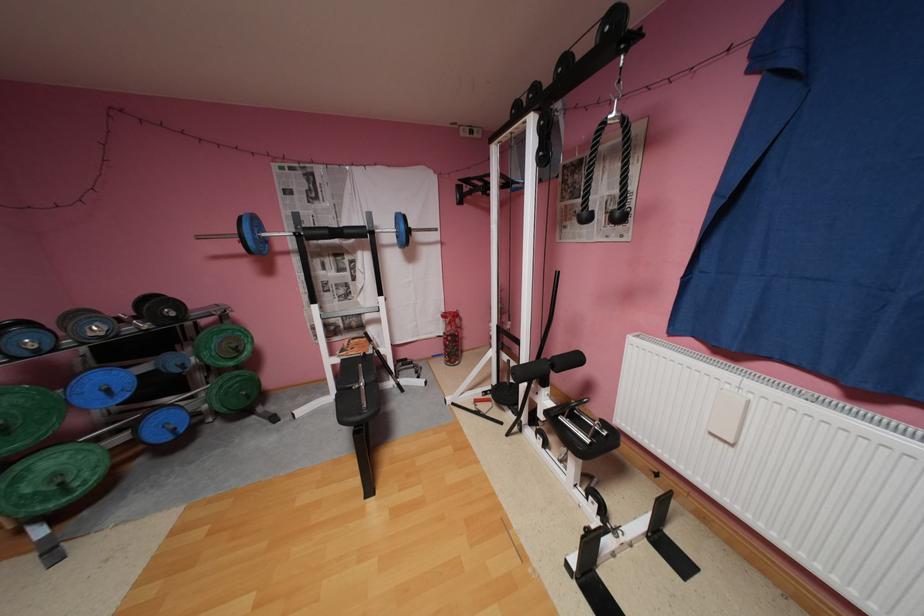
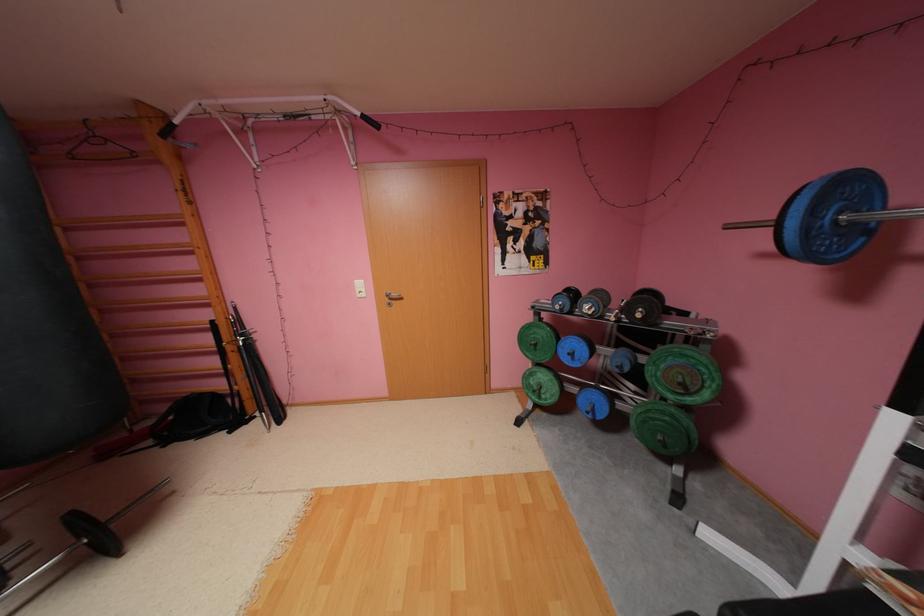
Find the pixel in the second image that matches point 180,438 in the first image.

(600, 416)